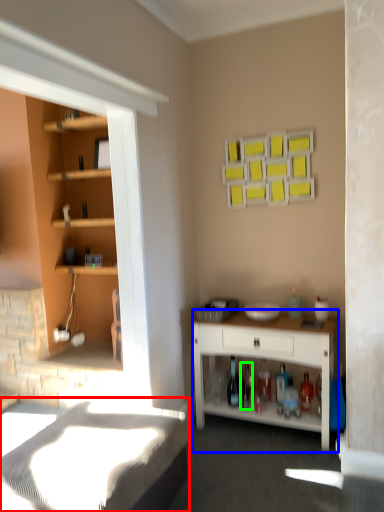
Question: Based on their relative distances, which object is farther from bed frame (highlighted by a red box)? Choose from desk (highlighted by a blue box) and bottle (highlighted by a green box).

Choices:
 (A) desk
 (B) bottle

Answer: (B)